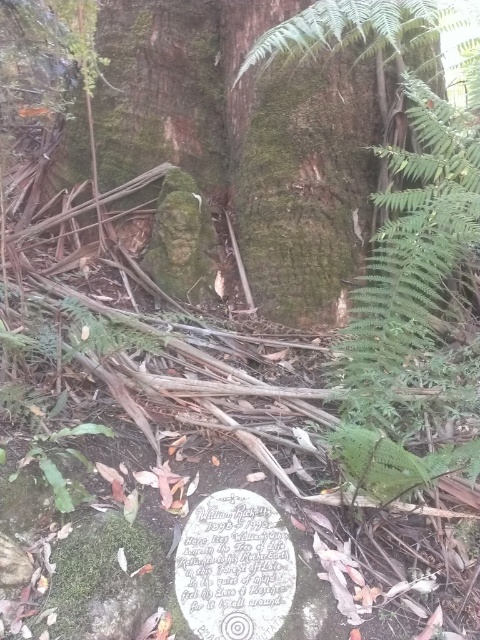
Question: Among these objects, which one is farthest from the camera?

Choices:
 (A) white stone plaque at center
 (B) green mossy tree trunk at center

Answer: (B)

Question: Where is green mossy tree trunk at center located in relation to white stone plaque at center in the image?

Choices:
 (A) left
 (B) right

Answer: (B)

Question: Is green mossy tree trunk at center positioned before white stone plaque at center?

Choices:
 (A) yes
 (B) no

Answer: (B)

Question: Which of the following is the closest to the observer?

Choices:
 (A) (283, 99)
 (B) (186, 580)

Answer: (B)

Question: Considering the relative positions of green mossy tree trunk at center and white stone plaque at center in the image provided, where is green mossy tree trunk at center located with respect to white stone plaque at center?

Choices:
 (A) left
 (B) right

Answer: (B)